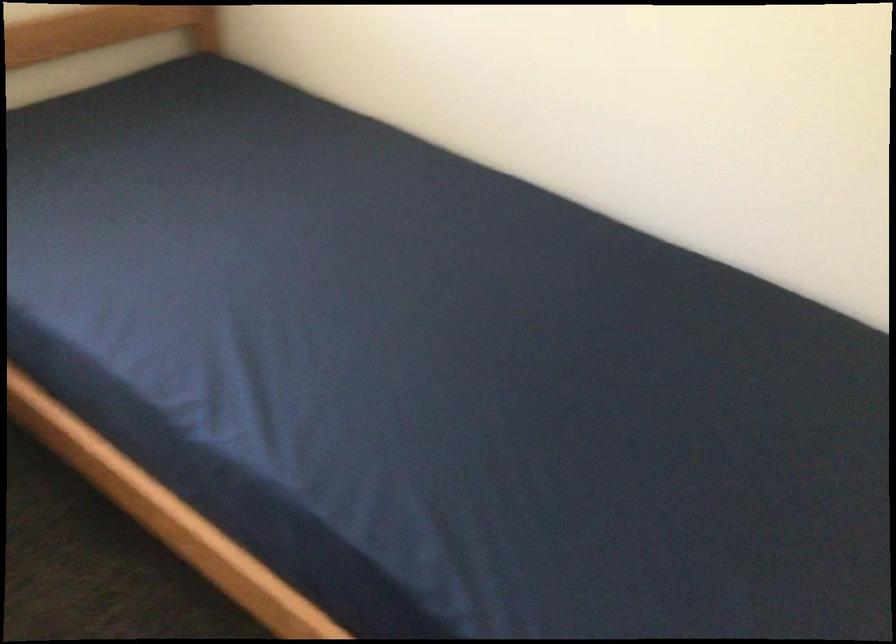
Question: The camera is either moving clockwise (left) or counter-clockwise (right) around the object. The first image is from the beginning of the video and the second image is from the end. Is the camera moving left or right when shooting the video?

Choices:
 (A) Left
 (B) Right

Answer: (B)